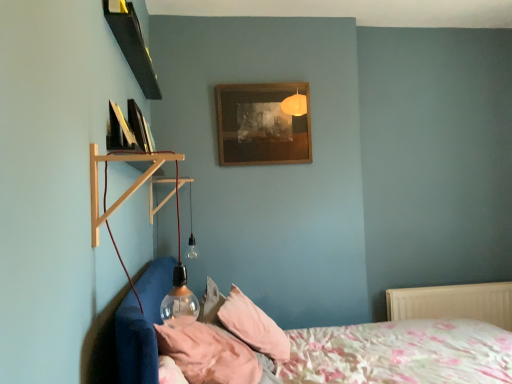
Question: Considering the positions of pink fabric pillow at lower center, which appears as the 1th pillow when viewed from the front, and wooden shelf at left in the image, is pink fabric pillow at lower center, which appears as the 1th pillow when viewed from the front, taller or shorter than wooden shelf at left?

Choices:
 (A) short
 (B) tall

Answer: (A)

Question: Is pink fabric pillow at lower center, which appears as the 1th pillow when viewed from the front, wider or thinner than wooden shelf at left?

Choices:
 (A) thin
 (B) wide

Answer: (B)

Question: Which object is the farthest from the floral cotton bed at lower left?

Choices:
 (A) wooden shelf at left
 (B) black glossy picture frame at upper left, which is the 2th picture frame from right to left
 (C) pink fabric pillow at lower center, which is the second pillow in front-to-back order
 (D) wooden frame at upper center, marked as the 1th picture frame in a back-to-front arrangement
 (E) pink fabric pillow at lower center, which is the second pillow in back-to-front order

Answer: (B)

Question: Which object is positioned farthest from the white plastic radiator at lower right?

Choices:
 (A) pink fabric pillow at lower center, which appears as the 1th pillow when viewed from the front
 (B) black glossy picture frame at upper left, which is the 2th picture frame from right to left
 (C) pink fabric pillow at lower center, which is the second pillow in front-to-back order
 (D) wooden shelf at left
 (E) floral cotton bed at lower left

Answer: (B)